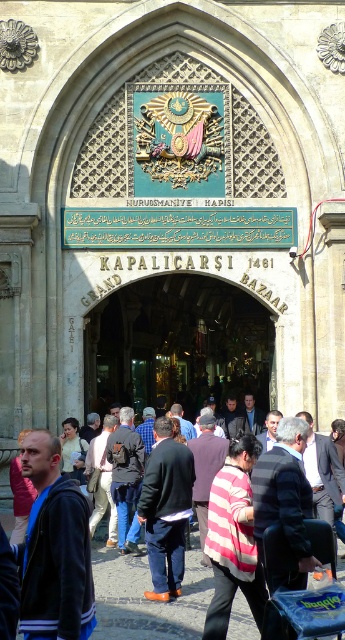
Question: Is the position of dark blue jacket at lower left less distant than that of striped fabric crowd at center?

Choices:
 (A) yes
 (B) no

Answer: (A)

Question: Among these points, which one is nearest to the camera?

Choices:
 (A) (131, 582)
 (B) (160, 468)
 (C) (54, 536)

Answer: (C)

Question: Which point is closer to the camera taking this photo?

Choices:
 (A) 339,563
 (B) 181,540
 (C) 82,515

Answer: (C)

Question: Can you confirm if striped fabric crowd at center is wider than dark blue jeans at center?

Choices:
 (A) no
 (B) yes

Answer: (B)

Question: Can you confirm if striped fabric crowd at center is positioned below dark blue jeans at center?

Choices:
 (A) no
 (B) yes

Answer: (B)

Question: Which is nearer to the dark blue jeans at center?

Choices:
 (A) striped fabric crowd at center
 (B) dark blue jacket at lower left

Answer: (A)